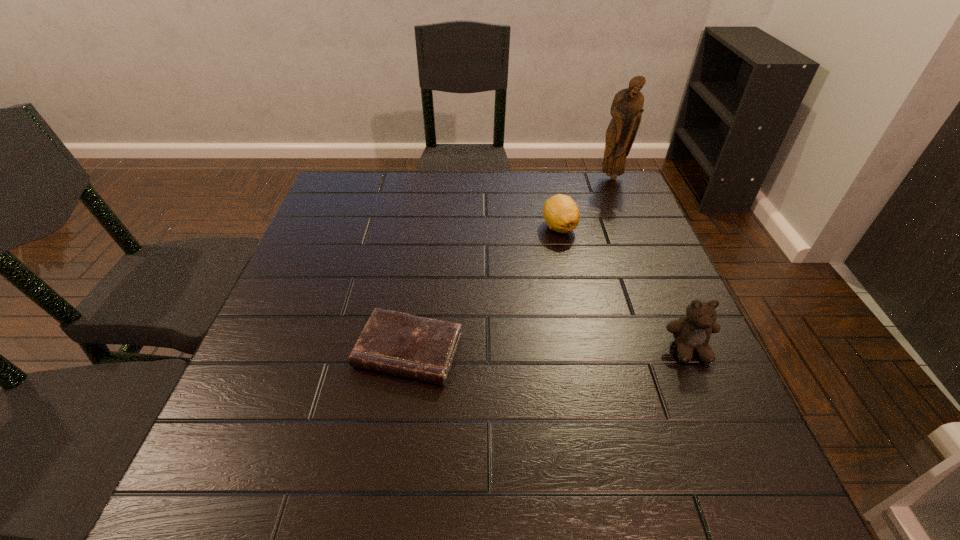
Find the location of a particular element. Image resolution: width=960 pixels, height=540 pixels. free space on the desktop that is between the shortest object and the teddy bear and is positioned at the stem end of the lemon is located at coordinates (555, 350).

Where is `free spot on the desktop that is between the leftmost object and the teddy bear and is positioned on the front-facing side of the farthest object`? free spot on the desktop that is between the leftmost object and the teddy bear and is positioned on the front-facing side of the farthest object is located at coordinates (555, 350).